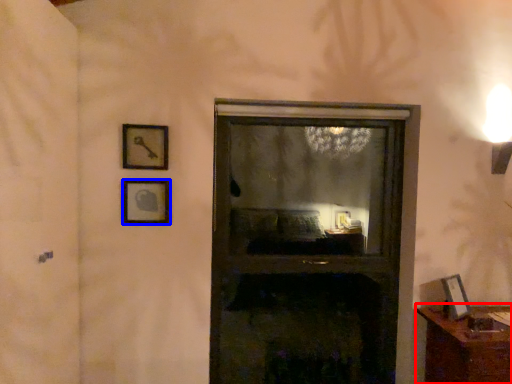
Question: Which object appears farthest to the camera in this image, furniture (highlighted by a red box) or picture frame (highlighted by a blue box)?

Choices:
 (A) furniture
 (B) picture frame

Answer: (B)